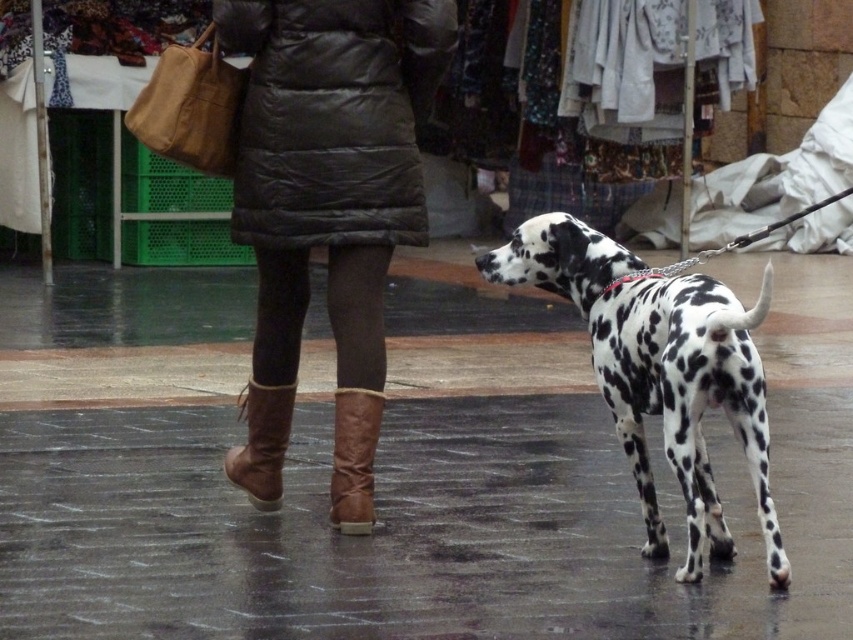
Question: Considering the real-world distances, which object is closest to the brown suede boot at lower center?

Choices:
 (A) leather boots at lower center
 (B) leather boots at center

Answer: (A)

Question: Is white-spotted fur dog at right below leather boots at lower center?

Choices:
 (A) no
 (B) yes

Answer: (A)

Question: Which object is the closest to the leather boots at lower center?

Choices:
 (A) brown suede boot at lower center
 (B) white-spotted fur dog at right

Answer: (A)

Question: Is brown suede boot at lower center above leather boots at lower center?

Choices:
 (A) yes
 (B) no

Answer: (B)

Question: Which object is closer to the camera taking this photo?

Choices:
 (A) brown suede boot at lower center
 (B) leather boots at lower center
 (C) leather boots at center

Answer: (C)

Question: Can you confirm if leather boots at center is wider than white-spotted fur dog at right?

Choices:
 (A) no
 (B) yes

Answer: (A)